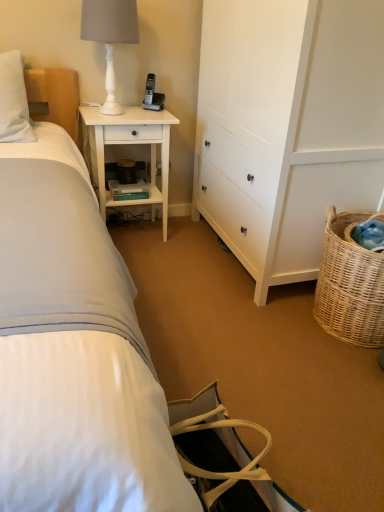
Question: From the image's perspective, is white wood cabinet at center right located above or below white matte table lamp at upper left?

Choices:
 (A) above
 (B) below

Answer: (B)

Question: Visually, is white wood cabinet at center right positioned to the left or to the right of white matte table lamp at upper left?

Choices:
 (A) right
 (B) left

Answer: (A)

Question: Which object is the farthest from the white wood cabinet at center right?

Choices:
 (A) black plastic phone at upper center
 (B) white wood nightstand at upper left
 (C) white matte table lamp at upper left
 (D) woven natural basket at lower right

Answer: (A)

Question: Based on their relative distances, which object is farther from the white wood nightstand at upper left?

Choices:
 (A) white wood cabinet at center right
 (B) woven natural basket at lower right
 (C) white matte table lamp at upper left
 (D) black plastic phone at upper center

Answer: (B)